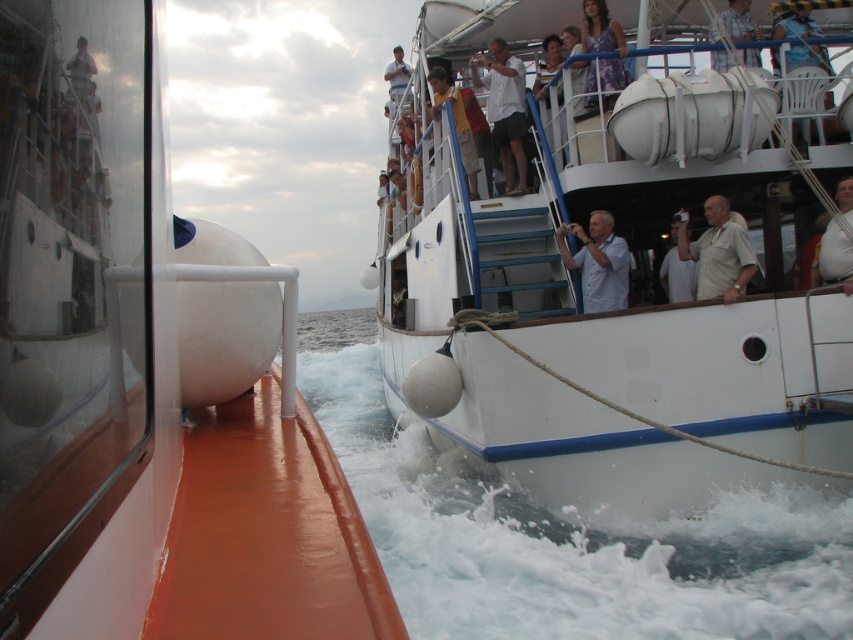
Question: Which of these objects is positioned closest to the white fabric shirt at upper right?

Choices:
 (A) white rubber buoy at left
 (B) light blue cotton shirt at center
 (C) yellow fabric shirt at upper center

Answer: (B)

Question: Is white rubber buoy at left bigger than white fabric shirt at upper right?

Choices:
 (A) yes
 (B) no

Answer: (A)

Question: Which object is positioned farthest from the white cotton shirt at upper right?

Choices:
 (A) white cotton shirt at upper center
 (B) purple floral dress at upper center

Answer: (A)

Question: Can you confirm if white rubber buoy at left is bigger than white matte lifebuoy at upper center?

Choices:
 (A) no
 (B) yes

Answer: (B)

Question: Which point is farther to the camera?

Choices:
 (A) (602, 76)
 (B) (460, 141)

Answer: (B)

Question: Does white cotton shirt at upper right appear on the right side of purple floral dress at upper center?

Choices:
 (A) yes
 (B) no

Answer: (A)